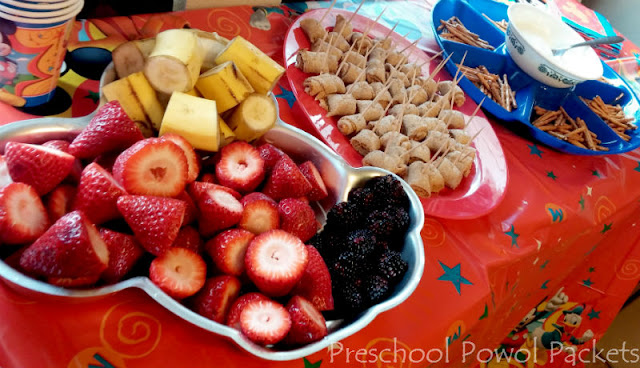
Locate an element on the screen. This screenshot has width=640, height=368. kids cups with orange and yellow is located at coordinates (24, 33).